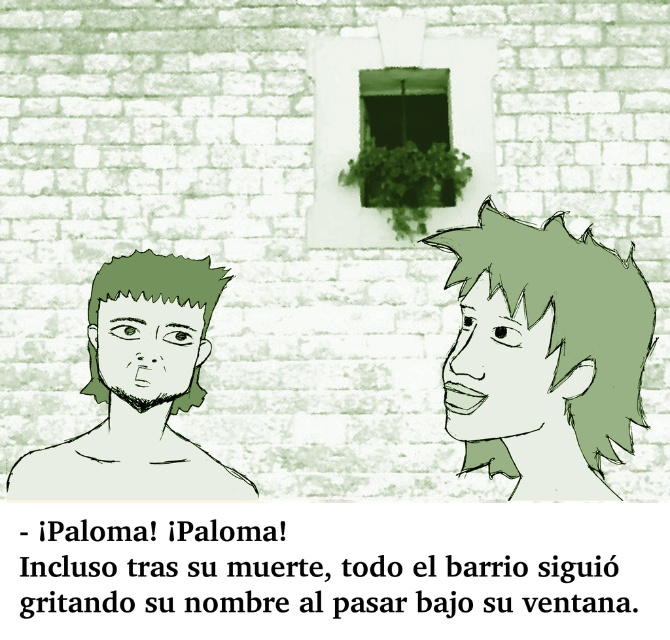
Between point (143, 333) and point (525, 340), which one is positioned in front?

Point (525, 340) is in front.

Is green matte head at left taller than green matte face at right?

Yes.

Which is behind, point (155, 275) or point (545, 316)?

The point (155, 275) is behind.

Where is `green matte head at left`? This screenshot has width=670, height=640. green matte head at left is located at coordinates (139, 390).

Does green spiky hair at right have a greater width compared to green matte head at left?

In fact, green spiky hair at right might be narrower than green matte head at left.

Between green spiky hair at right and green matte head at left, which one has less height?

Standing shorter between the two is green spiky hair at right.

Which is behind, point (641, 356) or point (139, 417)?

The point (139, 417) is behind.

This screenshot has height=640, width=670. In order to click on green spiky hair at right in this screenshot , I will do `click(543, 353)`.

In the scene shown: Is green spiky hair at right taller than green matte face at center?

Yes, green spiky hair at right is taller than green matte face at center.

Between green spiky hair at right and green matte face at center, which one is positioned higher?

green spiky hair at right is higher up.

Is point (565, 429) less distant than point (202, 314)?

Yes, it is.

The image size is (670, 640). I want to click on green spiky hair at right, so click(x=543, y=353).